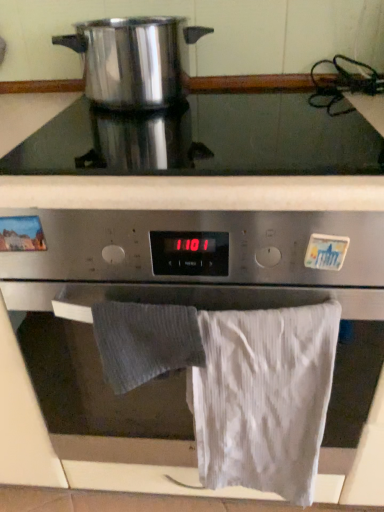
Question: Is white cotton towel at lower right, the 2th bath towel positioned from the left, facing towards gray textured towel at lower center, the 1th bath towel in the left-to-right sequence?

Choices:
 (A) no
 (B) yes

Answer: (A)

Question: Considering the relative sizes of white cotton towel at lower right, arranged as the first bath towel when viewed from the right, and gray textured towel at lower center, the 1th bath towel in the left-to-right sequence, in the image provided, is white cotton towel at lower right, arranged as the first bath towel when viewed from the right, shorter than gray textured towel at lower center, the 1th bath towel in the left-to-right sequence,?

Choices:
 (A) no
 (B) yes

Answer: (A)

Question: From a real-world perspective, is white cotton towel at lower right, the 2th bath towel positioned from the left, located higher than gray textured towel at lower center, acting as the second bath towel starting from the right?

Choices:
 (A) yes
 (B) no

Answer: (B)

Question: Considering the relative positions of white cotton towel at lower right, the 2th bath towel positioned from the left, and gray textured towel at lower center, the 1th bath towel in the left-to-right sequence, in the image provided, is white cotton towel at lower right, the 2th bath towel positioned from the left, to the left of gray textured towel at lower center, the 1th bath towel in the left-to-right sequence, from the viewer's perspective?

Choices:
 (A) yes
 (B) no

Answer: (B)

Question: From the image's perspective, is white cotton towel at lower right, arranged as the first bath towel when viewed from the right, beneath gray textured towel at lower center, the 1th bath towel in the left-to-right sequence?

Choices:
 (A) no
 (B) yes

Answer: (B)

Question: Relative to stainless steel oven at center, is polished stainless steel pot at upper left in front or behind?

Choices:
 (A) front
 (B) behind

Answer: (B)

Question: Considering the positions of polished stainless steel pot at upper left and stainless steel oven at center in the image, is polished stainless steel pot at upper left taller or shorter than stainless steel oven at center?

Choices:
 (A) short
 (B) tall

Answer: (A)

Question: From a real-world perspective, relative to stainless steel oven at center, is polished stainless steel pot at upper left vertically above or below?

Choices:
 (A) above
 (B) below

Answer: (A)

Question: Looking at their shapes, would you say polished stainless steel pot at upper left is wider or thinner than stainless steel oven at center?

Choices:
 (A) wide
 (B) thin

Answer: (B)

Question: Is stainless steel oven at center taller or shorter than satin silver cooktop at upper center?

Choices:
 (A) short
 (B) tall

Answer: (B)

Question: From a real-world perspective, is stainless steel oven at center positioned above or below satin silver cooktop at upper center?

Choices:
 (A) above
 (B) below

Answer: (B)

Question: Considering their positions, is stainless steel oven at center located in front of or behind satin silver cooktop at upper center?

Choices:
 (A) behind
 (B) front

Answer: (B)

Question: In terms of size, does stainless steel oven at center appear bigger or smaller than satin silver cooktop at upper center?

Choices:
 (A) small
 (B) big

Answer: (B)

Question: Looking at their shapes, would you say stainless steel oven at center is wider or thinner than polished stainless steel pot at upper left?

Choices:
 (A) thin
 (B) wide

Answer: (B)

Question: Is stainless steel oven at center to the left or to the right of polished stainless steel pot at upper left in the image?

Choices:
 (A) left
 (B) right

Answer: (B)